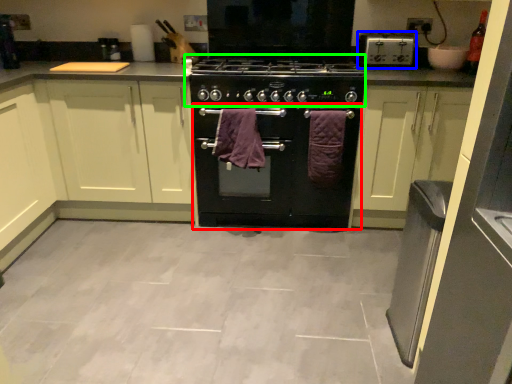
Question: Which is farther away from oven (highlighted by a red box)? home appliance (highlighted by a blue box) or gas stove (highlighted by a green box)?

Choices:
 (A) home appliance
 (B) gas stove

Answer: (A)